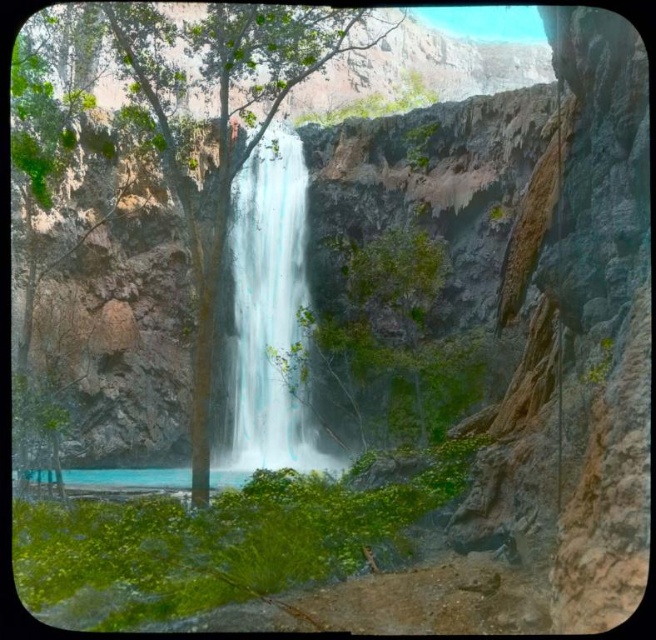
Can you confirm if white smooth waterfall at center is positioned below turquoise glossy water at center?

No.

Between white smooth waterfall at center and turquoise glossy water at center, which one has more height?

With more height is white smooth waterfall at center.

This screenshot has width=656, height=640. I want to click on white smooth waterfall at center, so click(x=266, y=316).

Locate an element on the screen. green leafy tree at center is located at coordinates (218, 124).

Is the position of green leafy tree at center less distant than that of white smooth waterfall at center?

Yes, green leafy tree at center is in front of white smooth waterfall at center.

Does point (144, 13) come farther from viewer compared to point (289, 220)?

No, (144, 13) is in front of (289, 220).

You are a GUI agent. You are given a task and a screenshot of the screen. Output one action in this format:
    pyautogui.click(x=<x>, y=<y>)
    Task: Click on the green leafy tree at center
    The height and width of the screenshot is (640, 656).
    Given the screenshot: What is the action you would take?
    pyautogui.click(x=218, y=124)

Can you confirm if green leafy tree at center is wider than turquoise glossy water at center?

Yes, green leafy tree at center is wider than turquoise glossy water at center.

In order to click on green leafy tree at center in this screenshot , I will do `click(218, 124)`.

In order to click on green leafy tree at center in this screenshot , I will do `click(218, 124)`.